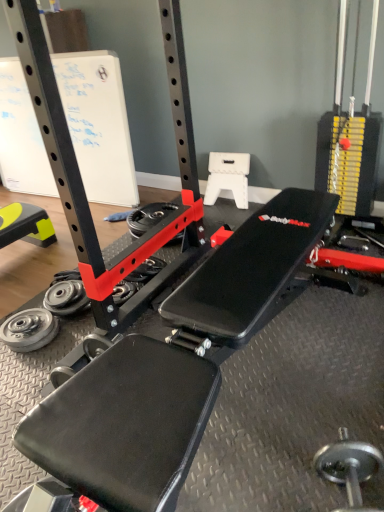
Identify the location of free point to the right of yellow rubber mat at lower left. The width and height of the screenshot is (384, 512). (61, 250).